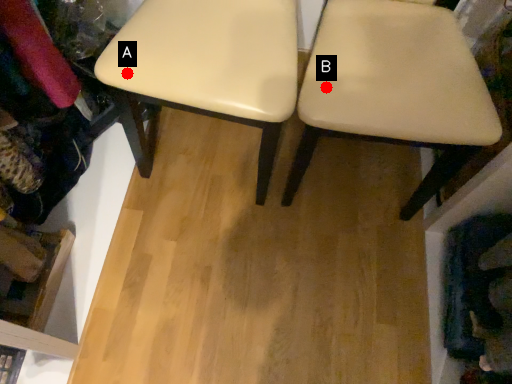
Question: Two points are circled on the image, labeled by A and B beside each circle. Which point is farther to the camera?

Choices:
 (A) A is further
 (B) B is further

Answer: (B)